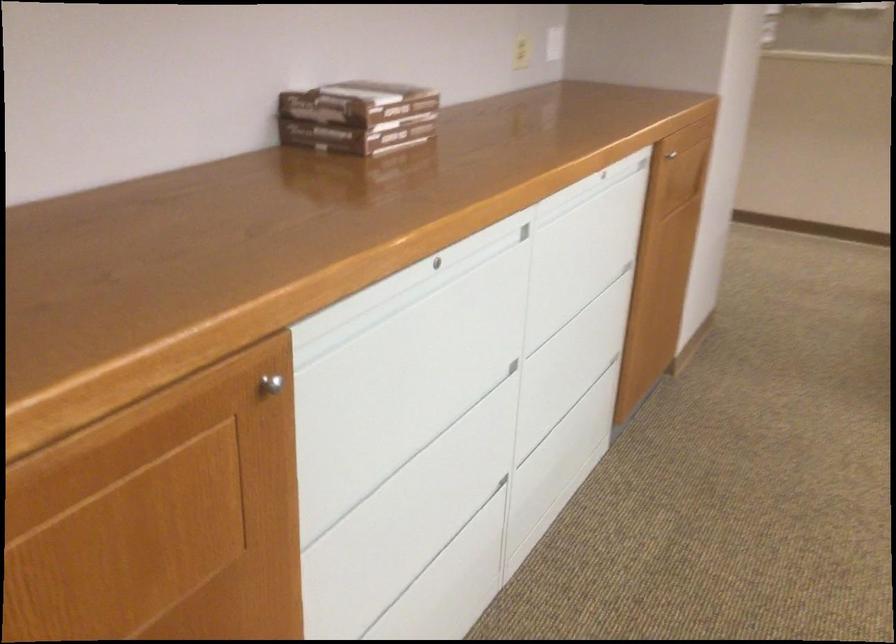
This screenshot has height=644, width=896. Find the location of `brown cardboard box`. brown cardboard box is located at coordinates (358, 117).